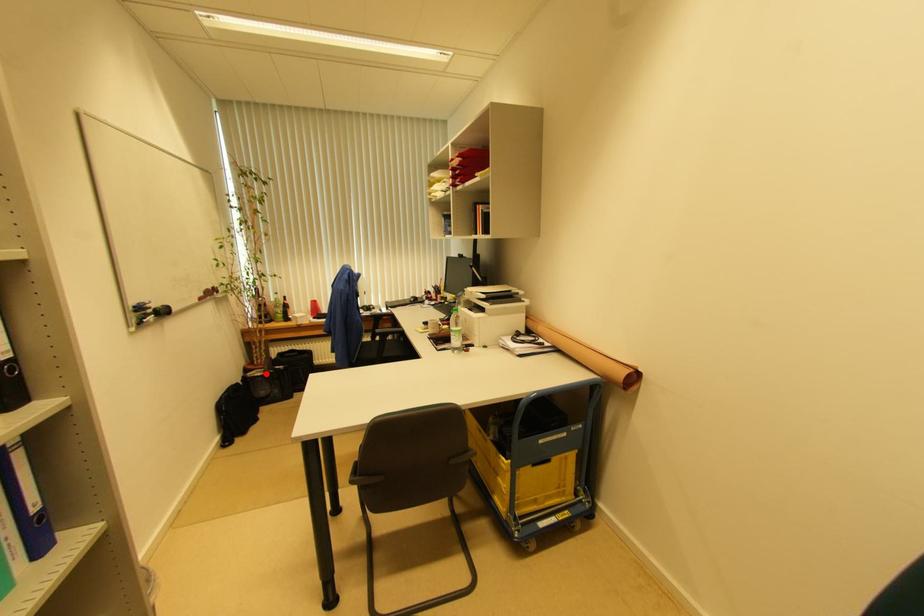
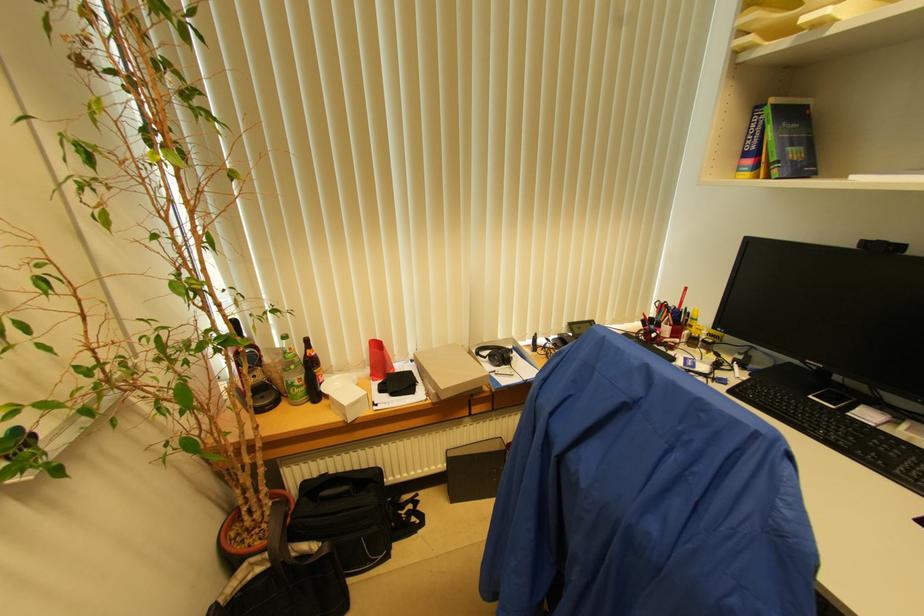
Question: I am providing you with two images of the same scene from different viewpoints. Given a red point in image1, look at the same physical point in image2. Is it:

Choices:
 (A) Closer to the viewpoint
 (B) Farther from the viewpoint

Answer: (A)